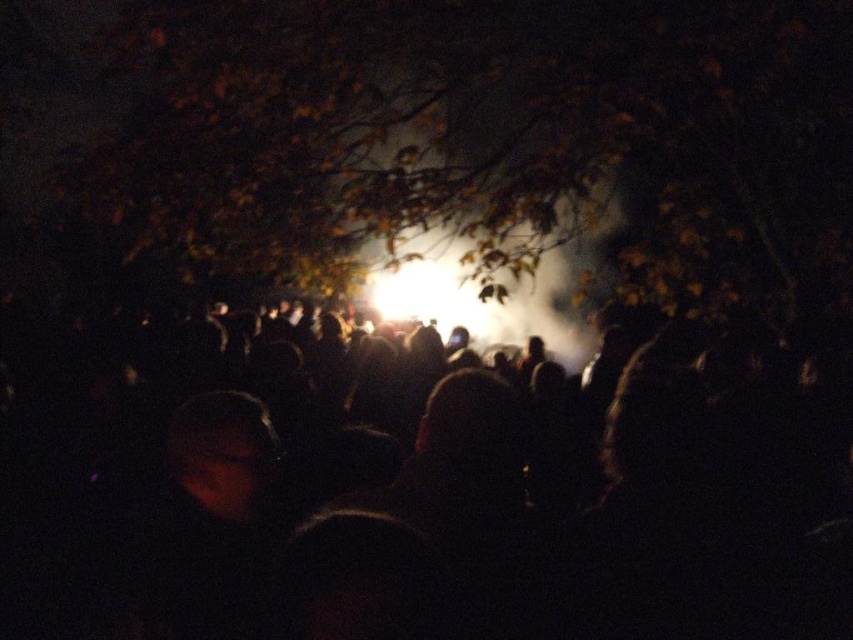
Question: Which point is closer to the camera taking this photo?

Choices:
 (A) (633, 192)
 (B) (741, 468)

Answer: (B)

Question: Is black matte crowd at center bigger than brown leafy tree at upper center?

Choices:
 (A) no
 (B) yes

Answer: (A)

Question: Is black matte crowd at center below brown leafy tree at upper center?

Choices:
 (A) no
 (B) yes

Answer: (B)

Question: Which of the following is the closest to the observer?

Choices:
 (A) black matte crowd at center
 (B) brown leafy tree at upper center

Answer: (A)

Question: Among these points, which one is farthest from the camera?

Choices:
 (A) (720, 232)
 (B) (660, 493)

Answer: (A)

Question: Is black matte crowd at center bigger than brown leafy tree at upper center?

Choices:
 (A) yes
 (B) no

Answer: (B)